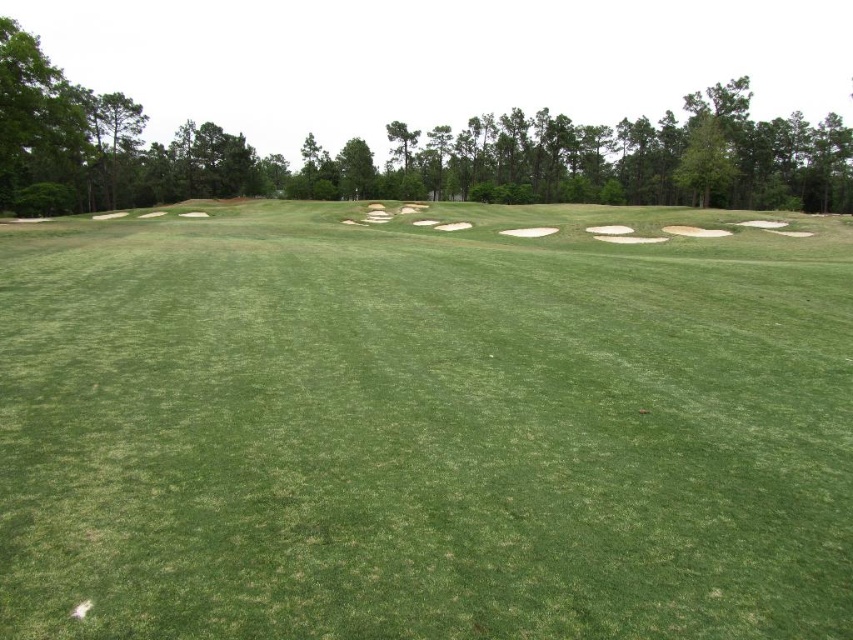
What are the coordinates of the green grassy field at center?

The coordinates of the green grassy field at center are at point (x=424, y=426).

You are standing at the point labeled point (424, 426) on a golf course map. What type of terrain are you currently standing on?

The point (424, 426) corresponds to the green grassy field at center, so you are standing on green grassy terrain.

You are a golfer standing on the green grassy field at center and want to hit the ball into the hole located behind the white sand bunker at center. Can you see the hole from your current position?

The green grassy field at center is positioned under the white sand bunker at center, so the bunker is blocking your view of the hole behind it. You cannot see the hole from your current position.